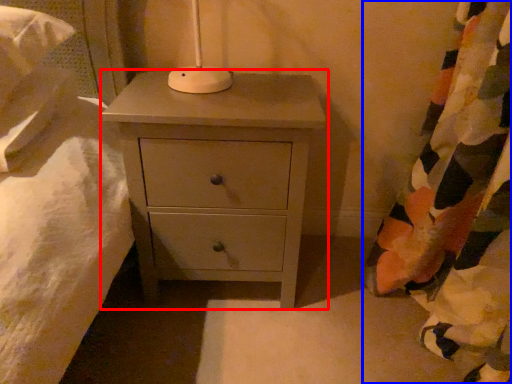
Question: Which point is closer to the camera, chest of drawers (highlighted by a red box) or curtain (highlighted by a blue box)?

Choices:
 (A) chest of drawers
 (B) curtain

Answer: (B)